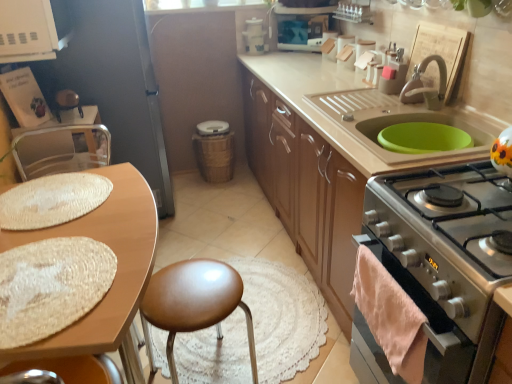
Question: Is green rubber mat at upper right taller or shorter than metallic silver chair at left?

Choices:
 (A) short
 (B) tall

Answer: (A)

Question: Is green rubber mat at upper right in front of or behind metallic silver chair at left in the image?

Choices:
 (A) behind
 (B) front

Answer: (B)

Question: Which of these objects is positioned closest to the matte wood cabinets at center?

Choices:
 (A) metallic silver chair at left
 (B) woven brown trash can at center, arranged as the second appliance when viewed from the top
 (C) wooden table at left
 (D) pink fluffy towel at lower right
 (E) green rubber mat at upper right

Answer: (E)

Question: Based on their relative distances, which object is nearer to the pink fluffy towel at lower right?

Choices:
 (A) matte wood cabinets at center
 (B) wooden table at left
 (C) metallic silver chair at left
 (D) green rubber mat at upper right
 (E) satin silver oven at lower right

Answer: (E)